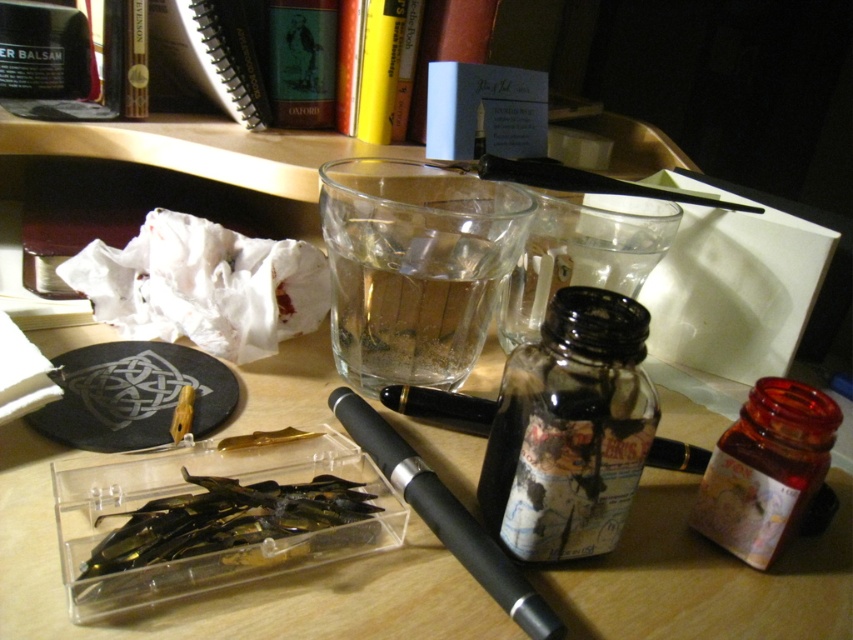
Which is below, transparent glass bottle at center or transparent plastic container with pens at center?

transparent plastic container with pens at center is below.

Does transparent glass bottle at center appear on the left side of transparent plastic container with pens at center?

Incorrect, transparent glass bottle at center is not on the left side of transparent plastic container with pens at center.

The height and width of the screenshot is (640, 853). Find the location of `transparent glass bottle at center`. transparent glass bottle at center is located at coordinates (570, 429).

Locate an element on the screen. transparent glass bottle at center is located at coordinates (570, 429).

Who is lower down, translucent amber jar at right or black rubberized pen at center?

black rubberized pen at center is below.

Can you confirm if translucent amber jar at right is positioned below black rubberized pen at center?

No.

In order to click on translucent amber jar at right in this screenshot , I will do `click(766, 468)`.

Is translucent amber jar at right to the right of transparent plastic container with pens at center from the viewer's perspective?

Indeed, translucent amber jar at right is positioned on the right side of transparent plastic container with pens at center.

Who is higher up, translucent amber jar at right or transparent plastic container with pens at center?

translucent amber jar at right is above.

Measure the distance between point (747, 534) and camera.

Point (747, 534) is 35.89 centimeters away from camera.

The height and width of the screenshot is (640, 853). I want to click on translucent amber jar at right, so click(x=766, y=468).